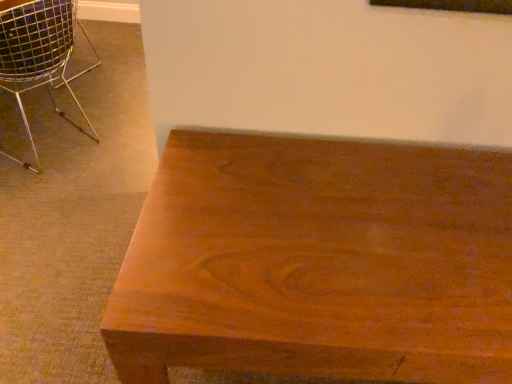
In order to face satin wood table at lower right, should I rotate leftwards or rightwards?

Turn right by 18.025 degrees to look at satin wood table at lower right.

The width and height of the screenshot is (512, 384). I want to click on satin wood table at lower right, so coord(318,262).

What do you see at coordinates (318, 262) in the screenshot?
I see `satin wood table at lower right` at bounding box center [318, 262].

Describe the element at coordinates (37, 55) in the screenshot. I see `metallic wire chair at left` at that location.

What are the coordinates of `metallic wire chair at left` in the screenshot? It's located at (37, 55).

Where is `satin wood table at lower right`? satin wood table at lower right is located at coordinates (318, 262).

Does satin wood table at lower right appear on the right side of metallic wire chair at left?

Yes, satin wood table at lower right is to the right of metallic wire chair at left.

Is satin wood table at lower right further to the viewer compared to metallic wire chair at left?

No, satin wood table at lower right is closer to the viewer.

Which point is more distant from viewer, (495, 292) or (20, 70)?

Positioned behind is point (20, 70).

From the image's perspective, is satin wood table at lower right above metallic wire chair at left?

Incorrect, from the image's perspective, satin wood table at lower right is lower than metallic wire chair at left.

From a real-world perspective, is satin wood table at lower right positioned above or below metallic wire chair at left?

From a real-world perspective, satin wood table at lower right is physically above metallic wire chair at left.

Considering the sizes of satin wood table at lower right and metallic wire chair at left in the image, is satin wood table at lower right wider or thinner than metallic wire chair at left?

Clearly, satin wood table at lower right has less width compared to metallic wire chair at left.

Can you confirm if satin wood table at lower right is taller than metallic wire chair at left?

Yes, satin wood table at lower right is taller than metallic wire chair at left.

Who is smaller, satin wood table at lower right or metallic wire chair at left?

metallic wire chair at left.

Is satin wood table at lower right completely or partially outside of metallic wire chair at left?

Yes, satin wood table at lower right is outside of metallic wire chair at left.

Is satin wood table at lower right far from metallic wire chair at left?

satin wood table at lower right is positioned a significant distance from metallic wire chair at left.

Is metallic wire chair at left at the back of satin wood table at lower right?

No, satin wood table at lower right is not facing away from metallic wire chair at left.

Locate an element on the screen. This screenshot has width=512, height=384. chair that is under the satin wood table at lower right (from a real-world perspective) is located at coordinates (37, 55).

Which is more to the right, metallic wire chair at left or satin wood table at lower right?

Positioned to the right is satin wood table at lower right.

Is metallic wire chair at left behind satin wood table at lower right?

Yes, the depth of metallic wire chair at left is greater than that of satin wood table at lower right.

Which is less distant, (56,107) or (481,183)?

The point (481,183) is in front.

From the image's perspective, is metallic wire chair at left under satin wood table at lower right?

No, from the image's perspective, metallic wire chair at left is not beneath satin wood table at lower right.

From a real-world perspective, is metallic wire chair at left under satin wood table at lower right?

Correct, in the physical world, metallic wire chair at left is lower than satin wood table at lower right.

From the picture: Which of these two, metallic wire chair at left or satin wood table at lower right, is thinner?

Thinner between the two is satin wood table at lower right.

In terms of height, does metallic wire chair at left look taller or shorter compared to satin wood table at lower right?

Clearly, metallic wire chair at left is shorter compared to satin wood table at lower right.

Considering the relative sizes of metallic wire chair at left and satin wood table at lower right in the image provided, is metallic wire chair at left bigger than satin wood table at lower right?

Incorrect, metallic wire chair at left is not larger than satin wood table at lower right.

Is metallic wire chair at left outside of satin wood table at lower right?

metallic wire chair at left is positioned outside satin wood table at lower right.

Is metallic wire chair at left in contact with satin wood table at lower right?

They are not placed beside each other.

Is metallic wire chair at left facing towards satin wood table at lower right?

No, metallic wire chair at left is not oriented towards satin wood table at lower right.

What's the angular difference between metallic wire chair at left and satin wood table at lower right's facing directions?

They differ by 121 degrees in their facing directions.

Measure the distance between metallic wire chair at left and satin wood table at lower right.

metallic wire chair at left and satin wood table at lower right are 4.93 feet apart from each other.

Where is `table below the metallic wire chair at left (from the image's perspective)`? table below the metallic wire chair at left (from the image's perspective) is located at coordinates (318, 262).

In order to click on chair located on the left of satin wood table at lower right in this screenshot , I will do `click(37, 55)`.

This screenshot has height=384, width=512. I want to click on chair above the satin wood table at lower right (from the image's perspective), so click(37, 55).